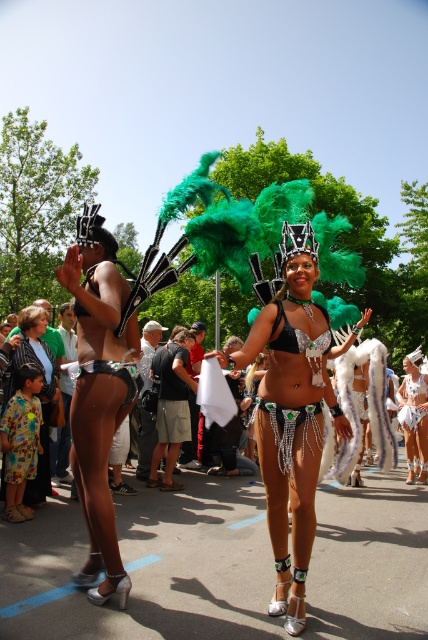
You are a photographer at the festival and want to capture both the matte black bikini at left and the white sequined bikini at center in a single frame. Since you can only focus on one subject at a time, which one should you focus on to ensure both are visible in the photo?

You should focus on the white sequined bikini at center because it is positioned centrally, making it easier to frame both the matte black bikini at left and the white sequined bikini at center in the photo.

You are a costume designer preparing for a parade. You have two bikinis to place on mannequins. The matte black bikini at left and the white sequined bikini at center. Which bikini should you choose if you need a larger size for a bigger mannequin?

The matte black bikini at left has a larger size compared to the white sequined bikini at center, so you should choose the matte black bikini at left for the bigger mannequin.